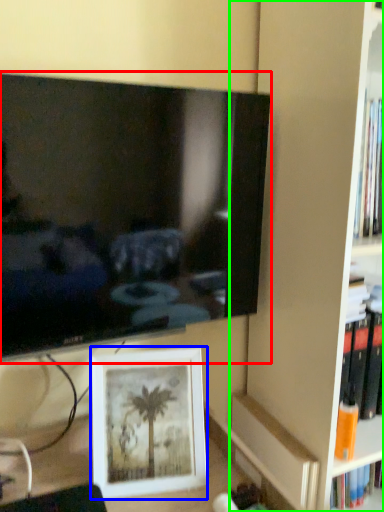
Question: Based on their relative distances, which object is farther from television (highlighted by a red box)? Choose from picture frame (highlighted by a blue box) and bookshelf (highlighted by a green box).

Choices:
 (A) picture frame
 (B) bookshelf

Answer: (B)